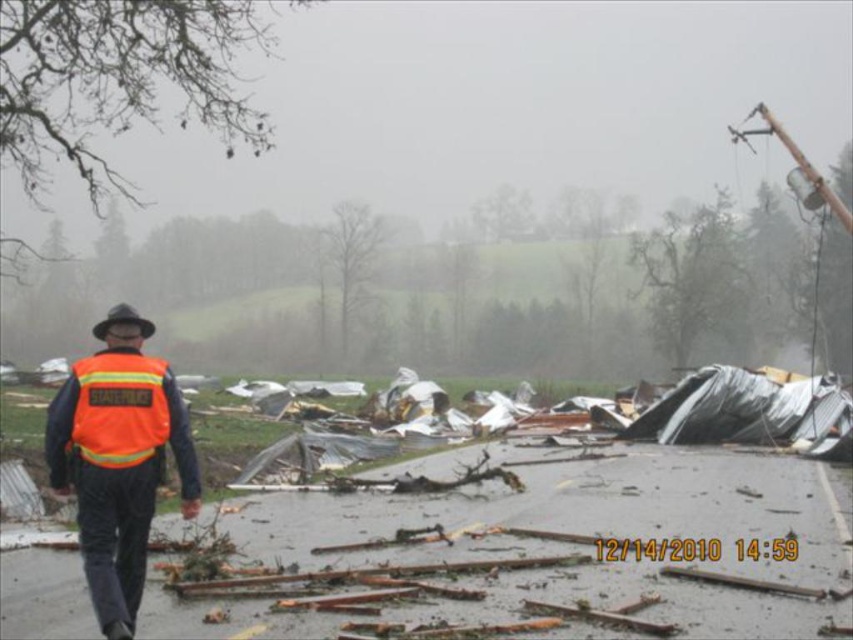
You are a rescue worker in the disaster area. You notice two items in the debris field, the orange reflective safety vest at left and the black felt hat at upper left. Which item is taller?

The orange reflective safety vest at left is taller than the black felt hat at upper left.

From the picture: You are a rescue worker in the disaster area. You need to retrieve an item from the orange reflective vest at left, but there is an orange reflective safety vest at left in the way. Can you reach the vest without moving the safety vest?

The orange reflective vest at left is 43.46 centimeters away from the orange reflective safety vest at left, so you can reach the vest without moving the safety vest since the distance is sufficient.

You are a rescue worker with a 1.5 meter long tool. You need to move from the orange reflective safety vest at left to the black felt hat at upper left. Can your tool reach the hat from the vest without moving it?

The distance between the orange reflective safety vest at left and the black felt hat at upper left is 1.77 meters. Since your tool is 1.5 meters long, it cannot fully reach the hat from the vest without moving it.